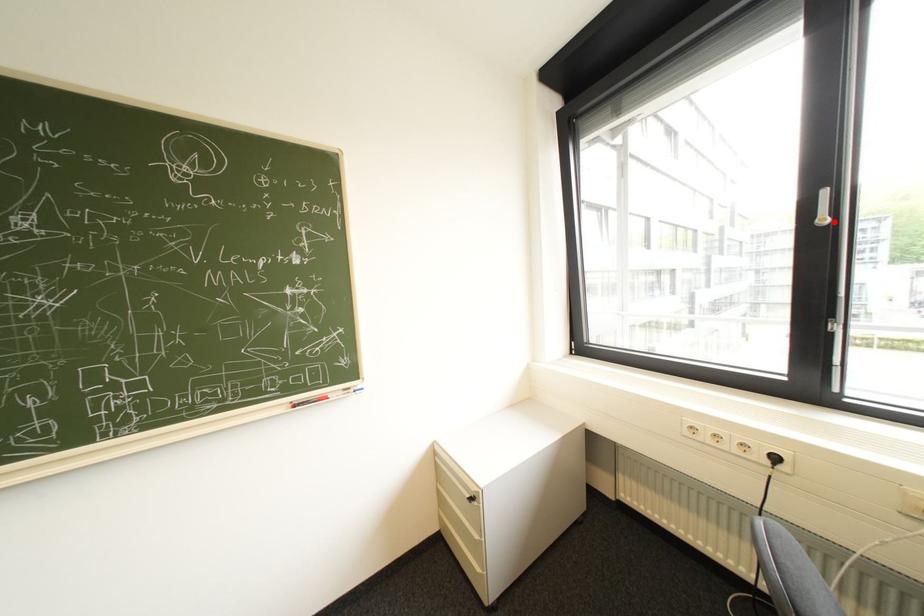
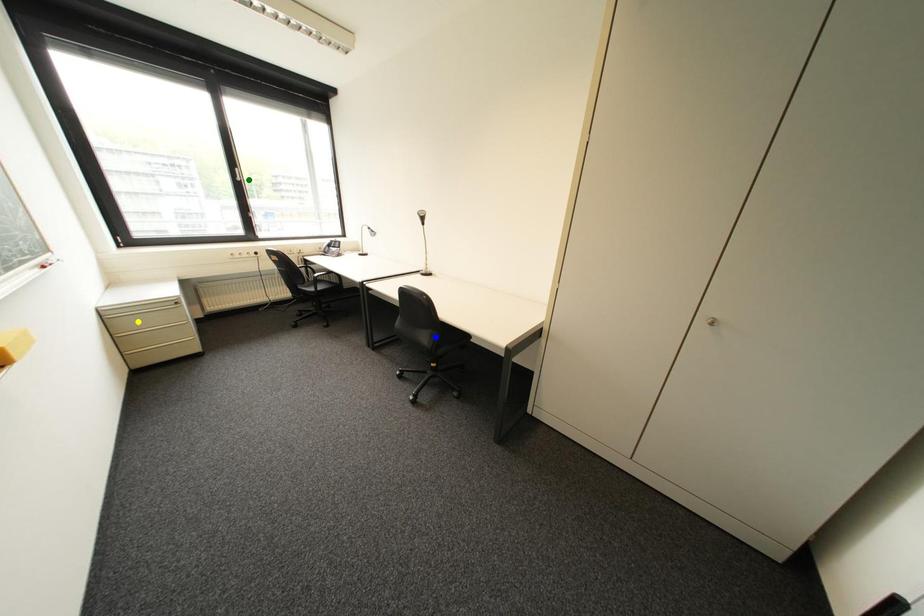
Question: I am providing you with two images of the same scene from different viewpoints. A red point is marked on the first image. You are given multiple points on the second image. Which spot in image 2 lines up with the point in image 1?

Choices:
 (A) blue point
 (B) green point
 (C) yellow point

Answer: (B)